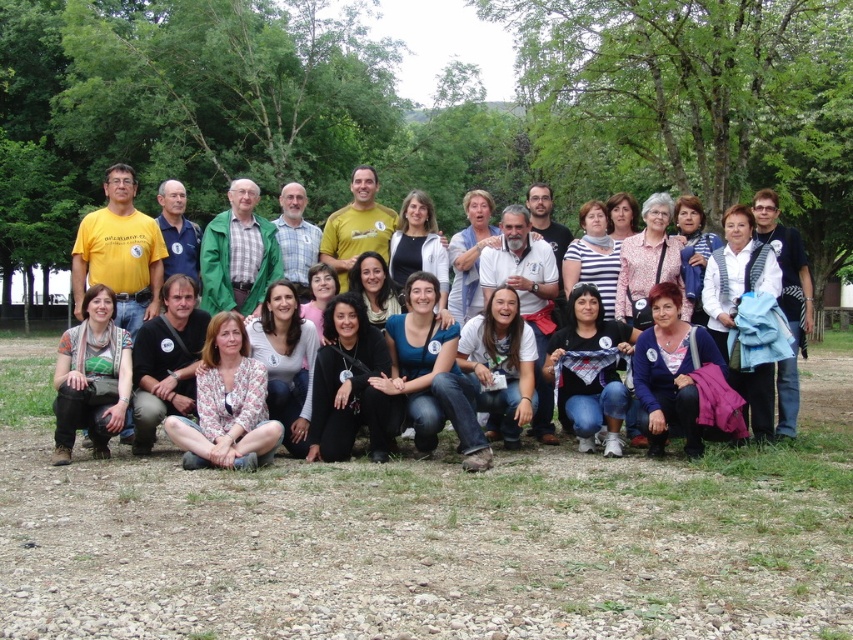
From the picture: You are part of a photography team setting up for an outdoor group photo. You notice the blue sweater at lower right and the light blue shirt at center. Based on their positions, which clothing item is closer to the camera?

The blue sweater at lower right is positioned under the light blue shirt at center, meaning it is closer to the camera since it is in the front row.

You are a photographer trying to capture a group photo. You are standing at the position where the photographer is. You want to ensure that both the matte black shirt at center and the blue sweater at lower right are in focus. Given that your camera has a depth of field that can cover 3 meters, will both subjects be in focus?

The matte black shirt at center is 3.08 meters away from the blue sweater at lower right. Since the distance between them is slightly more than 3 meters, the camera might struggle to keep both in focus simultaneously. Adjust your focus or consider a different camera setting to accommodate the distance.